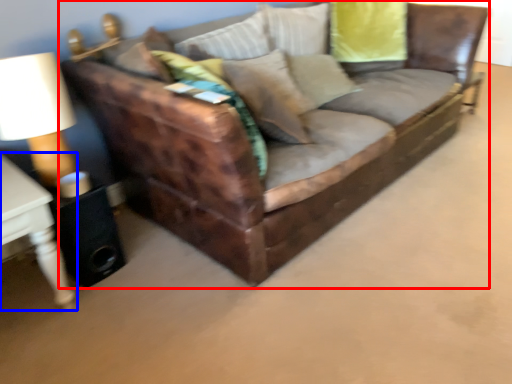
Question: Among these objects, which one is farthest to the camera, studio couch (highlighted by a red box) or table (highlighted by a blue box)?

Choices:
 (A) studio couch
 (B) table

Answer: (B)